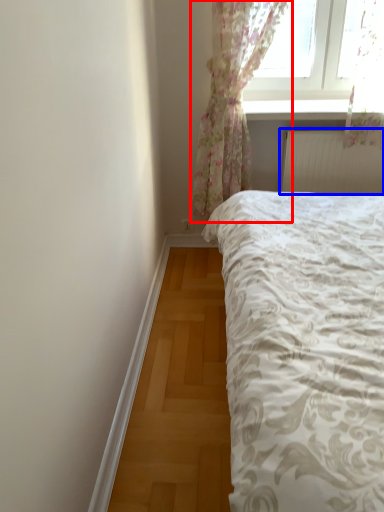
Question: Which object appears closest to the camera in this image, curtain (highlighted by a red box) or radiator (highlighted by a blue box)?

Choices:
 (A) curtain
 (B) radiator

Answer: (A)